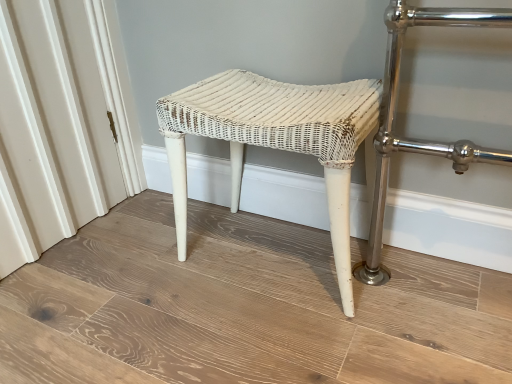
Find the location of a particular element. Image resolution: width=512 pixels, height=384 pixels. free spot above white wicker stool at center (from a real-world perspective) is located at coordinates (238, 287).